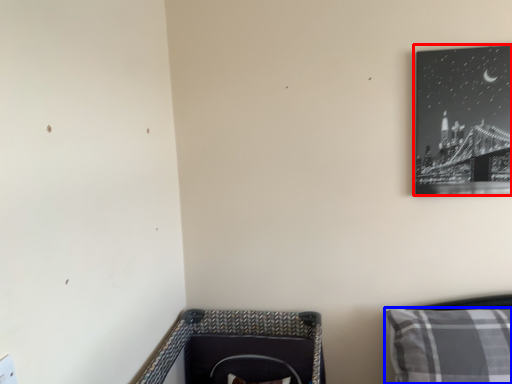
Question: Which object is further to the camera taking this photo, picture frame (highlighted by a red box) or pillow (highlighted by a blue box)?

Choices:
 (A) picture frame
 (B) pillow

Answer: (A)